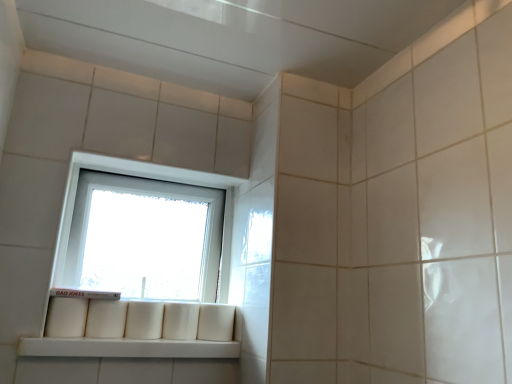
What do you see at coordinates (126, 348) in the screenshot? The image size is (512, 384). I see `white matte window sill at lower left` at bounding box center [126, 348].

At what (x,y) coordinates should I click in order to perform the action: click on white matte window sill at lower left. Please return your answer as a coordinate pair (x, y). This screenshot has height=384, width=512. Looking at the image, I should click on (126, 348).

What do you see at coordinates (129, 236) in the screenshot?
I see `white plastic window at center` at bounding box center [129, 236].

You are a GUI agent. You are given a task and a screenshot of the screen. Output one action in this format:
    pyautogui.click(x=<x>, y=<y>)
    Task: Click on the white plastic window at center
    
    Given the screenshot: What is the action you would take?
    pyautogui.click(x=129, y=236)

This screenshot has height=384, width=512. Identify the location of white matte window sill at lower left. (126, 348).

Does white matte window sill at lower left appear on the left side of white plastic window at center?

Yes, white matte window sill at lower left is to the left of white plastic window at center.

Is white matte window sill at lower left positioned in front of white plastic window at center?

Yes, it is in front of white plastic window at center.

Considering the points (140, 340) and (92, 178), which point is in front, point (140, 340) or point (92, 178)?

Point (140, 340)

From the image's perspective, which one is positioned lower, white matte window sill at lower left or white plastic window at center?

white matte window sill at lower left.

From a real-world perspective, relative to white plastic window at center, is white matte window sill at lower left vertically above or below?

From a real-world perspective, white matte window sill at lower left is physically below white plastic window at center.

Looking at this image, is white matte window sill at lower left wider than white plastic window at center?

Correct, the width of white matte window sill at lower left exceeds that of white plastic window at center.

Considering the relative sizes of white matte window sill at lower left and white plastic window at center in the image provided, is white matte window sill at lower left taller than white plastic window at center?

Incorrect, the height of white matte window sill at lower left is not larger of that of white plastic window at center.

Considering the sizes of white matte window sill at lower left and white plastic window at center in the image, is white matte window sill at lower left bigger or smaller than white plastic window at center?

In the image, white matte window sill at lower left appears to be smaller than white plastic window at center.

Which is correct: white matte window sill at lower left is inside white plastic window at center, or outside of it?

white matte window sill at lower left lies outside white plastic window at center.

Is white matte window sill at lower left touching white plastic window at center?

No, white matte window sill at lower left is not next to white plastic window at center.

Is white plastic window at center at the back of white matte window sill at lower left?

No, white plastic window at center is not at the back of white matte window sill at lower left.

Can you tell me how much white matte window sill at lower left and white plastic window at center differ in facing direction?

The angle between the facing direction of white matte window sill at lower left and the facing direction of white plastic window at center is 1.29 degrees.

Locate an element on the screen. The width and height of the screenshot is (512, 384). window on the right of white matte window sill at lower left is located at coordinates (129, 236).

Is white plastic window at center to the right of white matte window sill at lower left from the viewer's perspective?

Indeed, white plastic window at center is positioned on the right side of white matte window sill at lower left.

Which is in front, white plastic window at center or white matte window sill at lower left?

white matte window sill at lower left is closer to the camera.

Is point (175, 270) closer to viewer compared to point (170, 354)?

No.

From the image's perspective, is white plastic window at center located above or below white matte window sill at lower left?

white plastic window at center is above white matte window sill at lower left.

From a real-world perspective, is white plastic window at center physically above white matte window sill at lower left?

Yes, from a real-world perspective, white plastic window at center is above white matte window sill at lower left.

Is white plastic window at center thinner than white matte window sill at lower left?

Correct, the width of white plastic window at center is less than that of white matte window sill at lower left.

Is white plastic window at center shorter than white matte window sill at lower left?

Incorrect, the height of white plastic window at center does not fall short of that of white matte window sill at lower left.

In the scene shown: Between white plastic window at center and white matte window sill at lower left, which one has smaller size?

Smaller between the two is white matte window sill at lower left.

Is white matte window sill at lower left a part of white plastic window at center?

No, white matte window sill at lower left is located outside of white plastic window at center.

Is white plastic window at center far from white matte window sill at lower left?

No.

Could you tell me if white plastic window at center is turned towards white matte window sill at lower left?

No, white plastic window at center does not turn towards white matte window sill at lower left.

How many degrees apart are the facing directions of white plastic window at center and white matte window sill at lower left?

1.29 degrees.

Where is `window above the white matte window sill at lower left (from a real-world perspective)`? The height and width of the screenshot is (384, 512). window above the white matte window sill at lower left (from a real-world perspective) is located at coordinates (129, 236).

Locate an element on the screen. This screenshot has height=384, width=512. window above the white matte window sill at lower left (from the image's perspective) is located at coordinates (129, 236).

This screenshot has width=512, height=384. I want to click on window sill that appears below the white plastic window at center (from a real-world perspective), so click(126, 348).